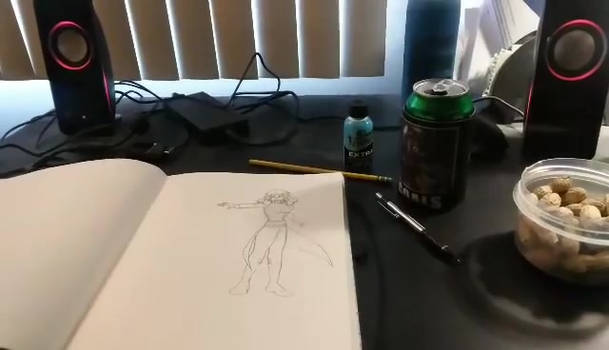
You are a GUI agent. You are given a task and a screenshot of the screen. Output one action in this format:
    pyautogui.click(x=<x>, y=<y>)
    Task: Click on the pen
    
    Given the screenshot: What is the action you would take?
    pyautogui.click(x=421, y=233)